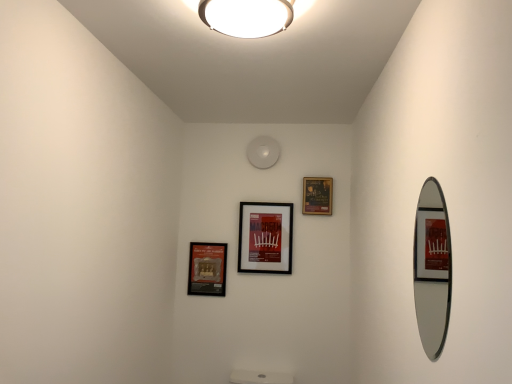
This screenshot has width=512, height=384. Describe the element at coordinates (432, 268) in the screenshot. I see `silver-framed mirror at right` at that location.

What do you see at coordinates (265, 238) in the screenshot?
I see `matte black picture frame at center, the 2th picture frame viewed from the left` at bounding box center [265, 238].

Where is `matte black picture frame at upper center, which ranks as the 3th picture frame in left-to-right order`? Image resolution: width=512 pixels, height=384 pixels. matte black picture frame at upper center, which ranks as the 3th picture frame in left-to-right order is located at coordinates (317, 195).

This screenshot has width=512, height=384. Identify the location of matte black picture frame at lower left, placed as the 1th picture frame when sorted from left to right. (207, 269).

Consider the image. Which of these two, matte black picture frame at upper center, which ranks as the 3th picture frame in left-to-right order, or matte black picture frame at lower left, placed as the third picture frame when sorted from right to left, is thinner?

With smaller width is matte black picture frame at lower left, placed as the third picture frame when sorted from right to left.

Which is correct: matte black picture frame at upper center, which ranks as the 3th picture frame in left-to-right order, is inside matte black picture frame at lower left, placed as the third picture frame when sorted from right to left, or outside of it?

matte black picture frame at upper center, which ranks as the 3th picture frame in left-to-right order, exists outside the volume of matte black picture frame at lower left, placed as the third picture frame when sorted from right to left.

How distant is matte black picture frame at upper center, which ranks as the 3th picture frame in left-to-right order, from matte black picture frame at lower left, placed as the third picture frame when sorted from right to left?

The distance of matte black picture frame at upper center, which ranks as the 3th picture frame in left-to-right order, from matte black picture frame at lower left, placed as the third picture frame when sorted from right to left, is 27.05 inches.

Considering the relative positions of matte black picture frame at upper center, which ranks as the 3th picture frame in left-to-right order, and matte black picture frame at lower left, placed as the 1th picture frame when sorted from left to right, in the image provided, is matte black picture frame at upper center, which ranks as the 3th picture frame in left-to-right order, to the left or to the right of matte black picture frame at lower left, placed as the 1th picture frame when sorted from left to right,?

In the image, matte black picture frame at upper center, which ranks as the 3th picture frame in left-to-right order, appears on the right side of matte black picture frame at lower left, placed as the 1th picture frame when sorted from left to right.

Considering the positions of points (197, 288) and (266, 220), is point (197, 288) closer to camera compared to point (266, 220)?

That is False.

Looking at the image, does matte black picture frame at lower left, placed as the 1th picture frame when sorted from left to right, seem bigger or smaller compared to matte black picture frame at center, the 2th picture frame viewed from the left?

Clearly, matte black picture frame at lower left, placed as the 1th picture frame when sorted from left to right, is smaller in size than matte black picture frame at center, the 2th picture frame viewed from the left.

Do you think matte black picture frame at lower left, placed as the third picture frame when sorted from right to left, is within matte black picture frame at center, the 2th picture frame viewed from the left, or outside of it?

matte black picture frame at lower left, placed as the third picture frame when sorted from right to left, lies outside matte black picture frame at center, the 2th picture frame viewed from the left.

From the image's perspective, is matte black picture frame at lower left, placed as the 1th picture frame when sorted from left to right, positioned above or below matte black picture frame at center, placed as the second picture frame when sorted from right to left?

matte black picture frame at lower left, placed as the 1th picture frame when sorted from left to right, is below matte black picture frame at center, placed as the second picture frame when sorted from right to left.

Locate an element on the screen. This screenshot has height=384, width=512. the 2nd picture frame to the right of the white glossy ceiling light at upper center, starting your count from the anchor is located at coordinates (317, 195).

Which is less distant, (288, 15) or (304, 188)?

The point (288, 15) is closer to the camera.

From the image's perspective, is white glossy ceiling light at upper center positioned above or below matte black picture frame at upper center, acting as the first picture frame starting from the right?

Based on their image positions, white glossy ceiling light at upper center is located above matte black picture frame at upper center, acting as the first picture frame starting from the right.

Could you measure the distance between white glossy ceiling light at upper center and matte black picture frame at upper center, acting as the first picture frame starting from the right?

white glossy ceiling light at upper center is 5.01 feet from matte black picture frame at upper center, acting as the first picture frame starting from the right.

Which object is positioned more to the left, white glossy ceiling light at upper center or matte black picture frame at center, placed as the second picture frame when sorted from right to left?

white glossy ceiling light at upper center.

Is white glossy ceiling light at upper center positioned beyond the bounds of matte black picture frame at center, the 2th picture frame viewed from the left?

Yes, white glossy ceiling light at upper center is outside of matte black picture frame at center, the 2th picture frame viewed from the left.

Which of these two, white glossy ceiling light at upper center or matte black picture frame at center, the 2th picture frame viewed from the left, is bigger?

white glossy ceiling light at upper center is bigger.

Which is nearer, (x=253, y=28) or (x=248, y=255)?

The point (x=253, y=28) is closer to the camera.

The image size is (512, 384). Find the location of `lamp lying behind the silver-framed mirror at right`. lamp lying behind the silver-framed mirror at right is located at coordinates (247, 17).

In terms of width, does white glossy ceiling light at upper center look wider or thinner when compared to silver-framed mirror at right?

Clearly, white glossy ceiling light at upper center has more width compared to silver-framed mirror at right.

Considering the sizes of objects white glossy ceiling light at upper center and silver-framed mirror at right in the image provided, who is smaller, white glossy ceiling light at upper center or silver-framed mirror at right?

Smaller between the two is silver-framed mirror at right.

Which point is more distant from viewer, [208,4] or [423,281]?

The point [423,281] is more distant.

Is white glossy ceiling light at upper center inside matte black picture frame at upper center, acting as the first picture frame starting from the right?

Actually, white glossy ceiling light at upper center is outside matte black picture frame at upper center, acting as the first picture frame starting from the right.

Between point (316, 189) and point (273, 8), which one is positioned behind?

The point (316, 189) is farther from the camera.

Does matte black picture frame at upper center, acting as the first picture frame starting from the right, have a lesser width compared to white glossy ceiling light at upper center?

Correct, the width of matte black picture frame at upper center, acting as the first picture frame starting from the right, is less than that of white glossy ceiling light at upper center.

Is matte black picture frame at center, placed as the second picture frame when sorted from right to left, at the back of silver-framed mirror at right?

That's not correct — silver-framed mirror at right is not looking away from matte black picture frame at center, placed as the second picture frame when sorted from right to left.

Is silver-framed mirror at right not inside matte black picture frame at center, the 2th picture frame viewed from the left?

silver-framed mirror at right lies outside matte black picture frame at center, the 2th picture frame viewed from the left,'s area.

Are silver-framed mirror at right and matte black picture frame at center, the 2th picture frame viewed from the left, beside each other?

No, silver-framed mirror at right is not with matte black picture frame at center, the 2th picture frame viewed from the left.

From a real-world perspective, is silver-framed mirror at right positioned under matte black picture frame at center, the 2th picture frame viewed from the left, based on gravity?

Yes.

Where is `the 2nd picture frame below the matte black picture frame at upper center, which ranks as the 3th picture frame in left-to-right order (from the image's perspective)`? The height and width of the screenshot is (384, 512). the 2nd picture frame below the matte black picture frame at upper center, which ranks as the 3th picture frame in left-to-right order (from the image's perspective) is located at coordinates [x=207, y=269].

Locate an element on the screen. picture frame directly beneath the matte black picture frame at center, placed as the second picture frame when sorted from right to left (from a real-world perspective) is located at coordinates (207, 269).

Considering their positions, is silver-framed mirror at right positioned further to matte black picture frame at upper center, acting as the first picture frame starting from the right, than matte black picture frame at lower left, placed as the third picture frame when sorted from right to left?

matte black picture frame at lower left, placed as the third picture frame when sorted from right to left, is further to matte black picture frame at upper center, acting as the first picture frame starting from the right.

Looking at the image, which one is located further to matte black picture frame at lower left, placed as the 1th picture frame when sorted from left to right, matte black picture frame at center, the 2th picture frame viewed from the left, or silver-framed mirror at right?

The object further to matte black picture frame at lower left, placed as the 1th picture frame when sorted from left to right, is silver-framed mirror at right.

Considering their positions, is matte black picture frame at center, placed as the second picture frame when sorted from right to left, positioned further to matte black picture frame at upper center, acting as the first picture frame starting from the right, than white glossy ceiling light at upper center?

white glossy ceiling light at upper center is positioned further to the anchor matte black picture frame at upper center, acting as the first picture frame starting from the right.

Estimate the real-world distances between objects in this image. Which object is further from matte black picture frame at center, placed as the second picture frame when sorted from right to left, white glossy ceiling light at upper center or matte black picture frame at lower left, placed as the 1th picture frame when sorted from left to right?

The object further to matte black picture frame at center, placed as the second picture frame when sorted from right to left, is white glossy ceiling light at upper center.

From the image, which object appears to be farther from white glossy ceiling light at upper center, matte black picture frame at center, the 2th picture frame viewed from the left, or silver-framed mirror at right?

Among the two, silver-framed mirror at right is located further to white glossy ceiling light at upper center.

Which object lies further to the anchor point white glossy ceiling light at upper center, matte black picture frame at lower left, placed as the 1th picture frame when sorted from left to right, or matte black picture frame at center, placed as the second picture frame when sorted from right to left?

matte black picture frame at lower left, placed as the 1th picture frame when sorted from left to right, lies further to white glossy ceiling light at upper center than the other object.

When comparing their distances from white glossy ceiling light at upper center, does silver-framed mirror at right or matte black picture frame at upper center, which ranks as the 3th picture frame in left-to-right order, seem closer?

matte black picture frame at upper center, which ranks as the 3th picture frame in left-to-right order.

Estimate the real-world distances between objects in this image. Which object is closer to matte black picture frame at upper center, which ranks as the 3th picture frame in left-to-right order, matte black picture frame at lower left, placed as the third picture frame when sorted from right to left, or silver-framed mirror at right?

silver-framed mirror at right is positioned closer to the anchor matte black picture frame at upper center, which ranks as the 3th picture frame in left-to-right order.

This screenshot has width=512, height=384. I want to click on picture frame between silver-framed mirror at right and matte black picture frame at upper center, which ranks as the 3th picture frame in left-to-right order, in the front-back direction, so click(265, 238).

Identify the location of lamp between silver-framed mirror at right and matte black picture frame at upper center, which ranks as the 3th picture frame in left-to-right order, along the z-axis. The image size is (512, 384). (247, 17).

Find the location of a particular element. Image resolution: width=512 pixels, height=384 pixels. picture frame positioned between white glossy ceiling light at upper center and matte black picture frame at upper center, which ranks as the 3th picture frame in left-to-right order, from near to far is located at coordinates (265, 238).

Find the location of `lamp positioned between silver-framed mirror at right and matte black picture frame at lower left, placed as the 1th picture frame when sorted from left to right, from near to far`. lamp positioned between silver-framed mirror at right and matte black picture frame at lower left, placed as the 1th picture frame when sorted from left to right, from near to far is located at coordinates (247, 17).